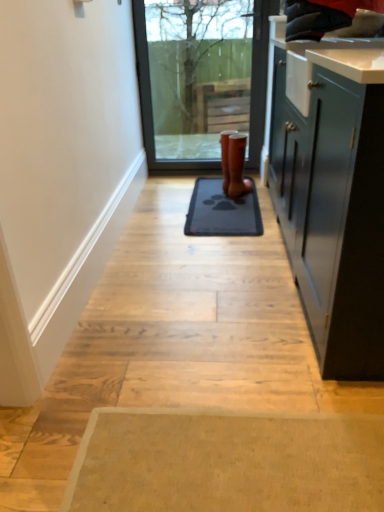
This screenshot has width=384, height=512. I want to click on free region on the left part of brown leather boot at center, so click(215, 191).